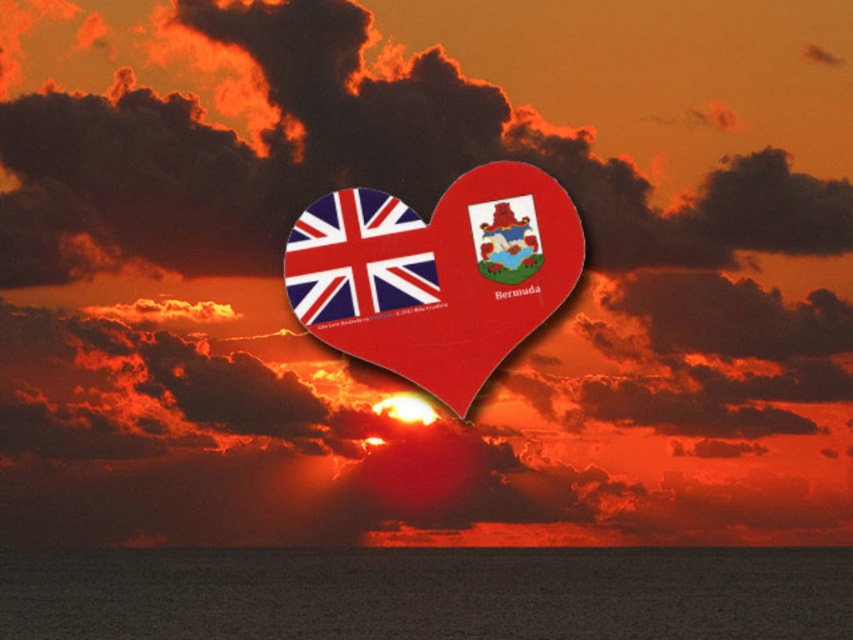
You are planning to place a small boat in the scene. The boat requires a surface area larger than the matte plastic heart at center. Can the smooth water at bottom accommodate the boat?

The smooth water at bottom is larger in size than the matte plastic heart at center, so yes, the smooth water at bottom can accommodate the boat since it has a larger surface area.